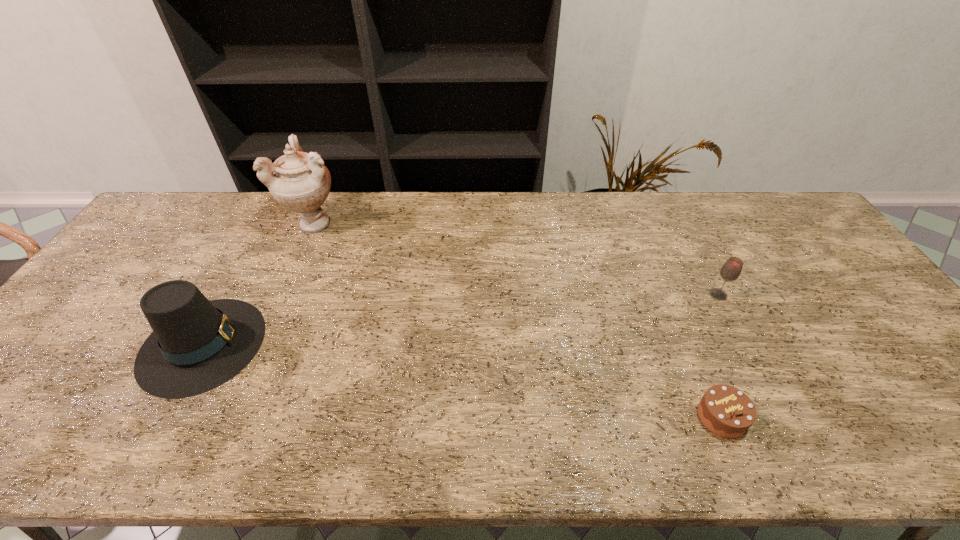
I want to click on free spot that satisfies the following two spatial constraints: 1. on the front-facing side of the second tallest object; 2. on the back side of the second object from right to left, so click(x=162, y=417).

You are a GUI agent. You are given a task and a screenshot of the screen. Output one action in this format:
    pyautogui.click(x=<x>, y=<y>)
    Task: Click on the vacant point that satisfies the following two spatial constraints: 1. on the front-facing side of the shortest object; 2. on the left side of the third shortest object
    
    Given the screenshot: What is the action you would take?
    pyautogui.click(x=162, y=417)

Where is `free spot that satisfies the following two spatial constraints: 1. on the front side of the tallest object; 2. on the front-facing side of the hat`? This screenshot has width=960, height=540. free spot that satisfies the following two spatial constraints: 1. on the front side of the tallest object; 2. on the front-facing side of the hat is located at coordinates (266, 344).

In order to click on free spot that satisfies the following two spatial constraints: 1. on the back side of the glass drink container; 2. on the left side of the third object from left to right in this screenshot , I will do `click(671, 295)`.

Image resolution: width=960 pixels, height=540 pixels. I want to click on vacant region that satisfies the following two spatial constraints: 1. on the back side of the rightmost object; 2. on the left side of the chocolate cake, so click(x=671, y=295).

Where is `vacant region that satisfies the following two spatial constraints: 1. on the front-facing side of the second object from right to left; 2. on the left side of the third shortest object`? The image size is (960, 540). vacant region that satisfies the following two spatial constraints: 1. on the front-facing side of the second object from right to left; 2. on the left side of the third shortest object is located at coordinates (162, 417).